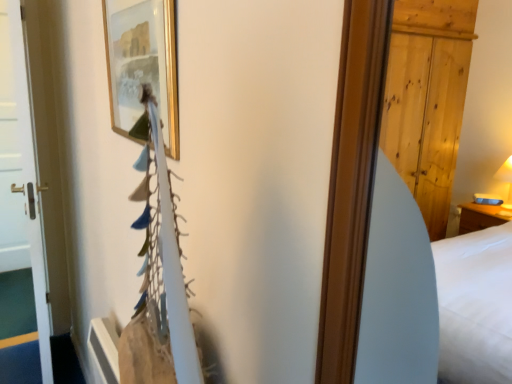
Locate an element on the screen. This screenshot has width=512, height=384. gold/gilded picture frame at upper center is located at coordinates (142, 66).

What do you see at coordinates (142, 66) in the screenshot? Image resolution: width=512 pixels, height=384 pixels. I see `gold/gilded picture frame at upper center` at bounding box center [142, 66].

What do you see at coordinates (20, 174) in the screenshot? I see `white glossy door at left` at bounding box center [20, 174].

At what (x,y) coordinates should I click in order to perform the action: click on white glossy door at left. Please return your answer as a coordinate pair (x, y). Image resolution: width=512 pixels, height=384 pixels. Looking at the image, I should click on (20, 174).

Where is `gold/gilded picture frame at upper center`? This screenshot has width=512, height=384. gold/gilded picture frame at upper center is located at coordinates (142, 66).

Is gold/gilded picture frame at upper center to the right of white glossy door at left from the viewer's perspective?

Yes, gold/gilded picture frame at upper center is to the right of white glossy door at left.

Which is behind, gold/gilded picture frame at upper center or white glossy door at left?

Positioned behind is white glossy door at left.

Which point is more distant from viewer, (109,77) or (13,234)?

The point (13,234) is behind.

Consider the image. From the image's perspective, between gold/gilded picture frame at upper center and white glossy door at left, which one is located above?

gold/gilded picture frame at upper center, from the image's perspective.

From a real-world perspective, which object rests below the other?

From a 3D spatial view, white glossy door at left is below.

Which of these two, gold/gilded picture frame at upper center or white glossy door at left, is thinner?

gold/gilded picture frame at upper center.

From the picture: Who is shorter, gold/gilded picture frame at upper center or white glossy door at left?

Standing shorter between the two is gold/gilded picture frame at upper center.

In the scene shown: Which of these two, gold/gilded picture frame at upper center or white glossy door at left, is smaller?

Smaller between the two is gold/gilded picture frame at upper center.

Is white glossy door at left completely or partially inside gold/gilded picture frame at upper center?

No.

Is gold/gilded picture frame at upper center directly adjacent to white glossy door at left?

No, gold/gilded picture frame at upper center is not next to white glossy door at left.

Is gold/gilded picture frame at upper center positioned with its back to white glossy door at left?

No, gold/gilded picture frame at upper center is not facing away from white glossy door at left.

Looking at this image, can you tell me how much gold/gilded picture frame at upper center and white glossy door at left differ in facing direction?

3.01 degrees.

Find the location of `picture frame on the right of white glossy door at left`. picture frame on the right of white glossy door at left is located at coordinates (142, 66).

Does white glossy door at left appear on the right side of gold/gilded picture frame at upper center?

Incorrect, white glossy door at left is not on the right side of gold/gilded picture frame at upper center.

Which object is more forward, white glossy door at left or gold/gilded picture frame at upper center?

Positioned in front is gold/gilded picture frame at upper center.

Between point (35, 296) and point (129, 94), which one is positioned behind?

Positioned behind is point (35, 296).

From the image's perspective, between white glossy door at left and gold/gilded picture frame at upper center, who is located below?

white glossy door at left is shown below in the image.

From a real-world perspective, which object rests below the other?

white glossy door at left is physically lower.

Which object is wider, white glossy door at left or gold/gilded picture frame at upper center?

white glossy door at left is wider.

Is white glossy door at left taller than gold/gilded picture frame at upper center?

Yes, white glossy door at left is taller than gold/gilded picture frame at upper center.

In the scene shown: Between white glossy door at left and gold/gilded picture frame at upper center, which one has larger size?

white glossy door at left.

Is white glossy door at left not within gold/gilded picture frame at upper center?

Absolutely, white glossy door at left is external to gold/gilded picture frame at upper center.

Is white glossy door at left in contact with gold/gilded picture frame at upper center?

No.

Does white glossy door at left turn towards gold/gilded picture frame at upper center?

No, white glossy door at left is not turned towards gold/gilded picture frame at upper center.

From the picture: Can you tell me how much white glossy door at left and gold/gilded picture frame at upper center differ in facing direction?

The angle between the facing direction of white glossy door at left and the facing direction of gold/gilded picture frame at upper center is 3.01 degrees.

At what (x,y) coordinates should I click in order to perform the action: click on door that appears on the left of gold/gilded picture frame at upper center. Please return your answer as a coordinate pair (x, y). The image size is (512, 384). Looking at the image, I should click on tap(20, 174).

The height and width of the screenshot is (384, 512). Identify the location of door behind the gold/gilded picture frame at upper center. (20, 174).

Locate an element on the screen. picture frame on the right of white glossy door at left is located at coordinates (142, 66).